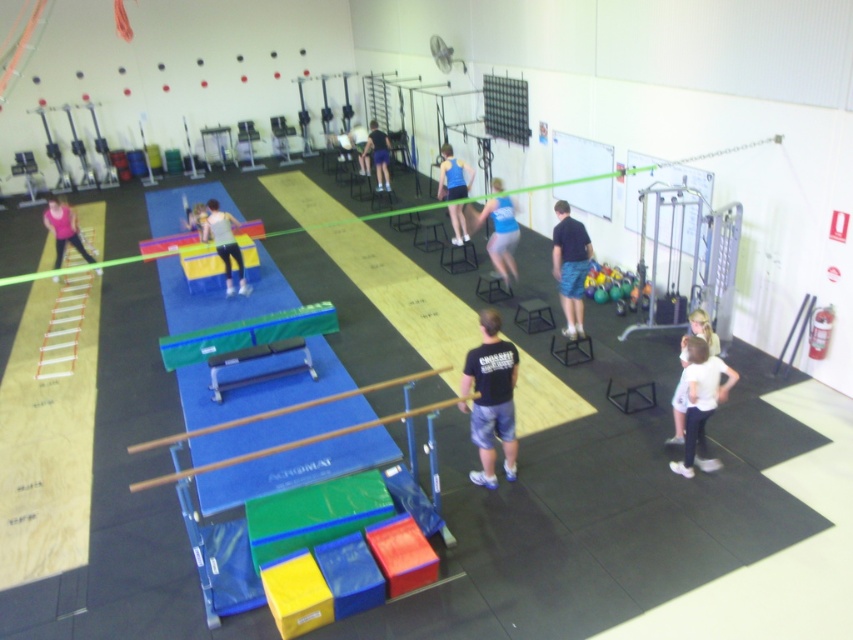
You are a gym instructor observing a participant wearing the white matte shirt at lower right and the blue fabric shorts at center. Which piece of clothing is shorter in height?

The white matte shirt at lower right is not as tall as the blue fabric shorts at center, so the white matte shirt at lower right is shorter in height.

You are a photographer standing in the gymnasium and want to take a photo of both the blue fabric shorts at center and the white cotton shirt at lower right. Which one should you adjust your camera focus on first to ensure both are in the frame?

You should focus on the blue fabric shorts at center first because it is closer to you than the white cotton shirt at lower right, ensuring both are in the frame by adjusting focus from near to far.